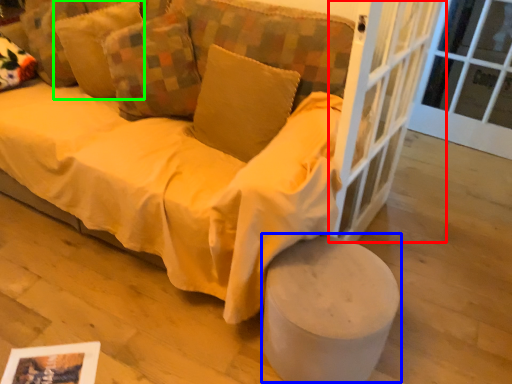
Question: Which is farther away from screen door (highlighted by a red box)? stool (highlighted by a blue box) or pillow (highlighted by a green box)?

Choices:
 (A) stool
 (B) pillow

Answer: (B)